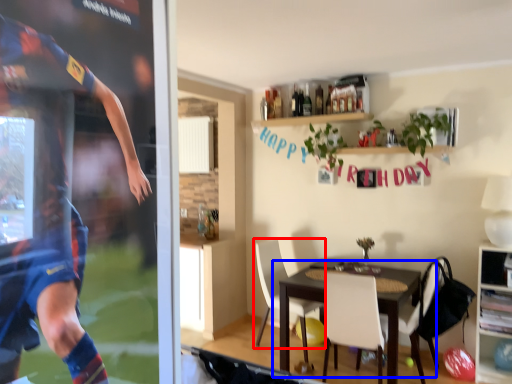
Question: Which object appears closest to the camera in this image, chair (highlighted by a red box) or table (highlighted by a blue box)?

Choices:
 (A) chair
 (B) table

Answer: (B)